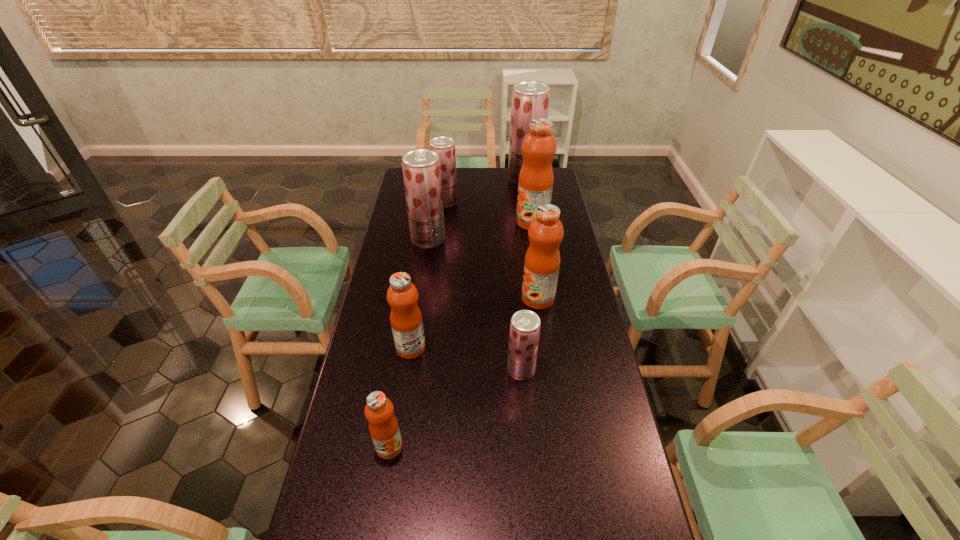
Identify the location of the nearest object. (383, 425).

The height and width of the screenshot is (540, 960). Find the location of `the nearest orange fruit juice`. the nearest orange fruit juice is located at coordinates (383, 425).

Identify the location of free space located on the front of the biggest strawberry fruit juice. (532, 222).

Where is `free location located on the front label of the biggest orange fruit juice`? Image resolution: width=960 pixels, height=540 pixels. free location located on the front label of the biggest orange fruit juice is located at coordinates (468, 222).

Where is `free region located 0.310m on the front label of the biggest orange fruit juice`? free region located 0.310m on the front label of the biggest orange fruit juice is located at coordinates (445, 222).

In order to click on vacant region located on the front label of the biggest orange fruit juice in this screenshot , I will do `click(504, 222)`.

Locate an element on the screen. This screenshot has height=540, width=960. vacant point located on the front of the third smallest strawberry fruit juice is located at coordinates (425, 261).

Where is `free location located 0.230m on the front label of the third nearest orange fruit juice`? The image size is (960, 540). free location located 0.230m on the front label of the third nearest orange fruit juice is located at coordinates (457, 298).

This screenshot has width=960, height=540. I want to click on vacant space positioned 0.240m on the front label of the third nearest orange fruit juice, so click(454, 298).

Where is `vacant region located 0.370m on the front label of the third nearest orange fruit juice`? The image size is (960, 540). vacant region located 0.370m on the front label of the third nearest orange fruit juice is located at coordinates (419, 298).